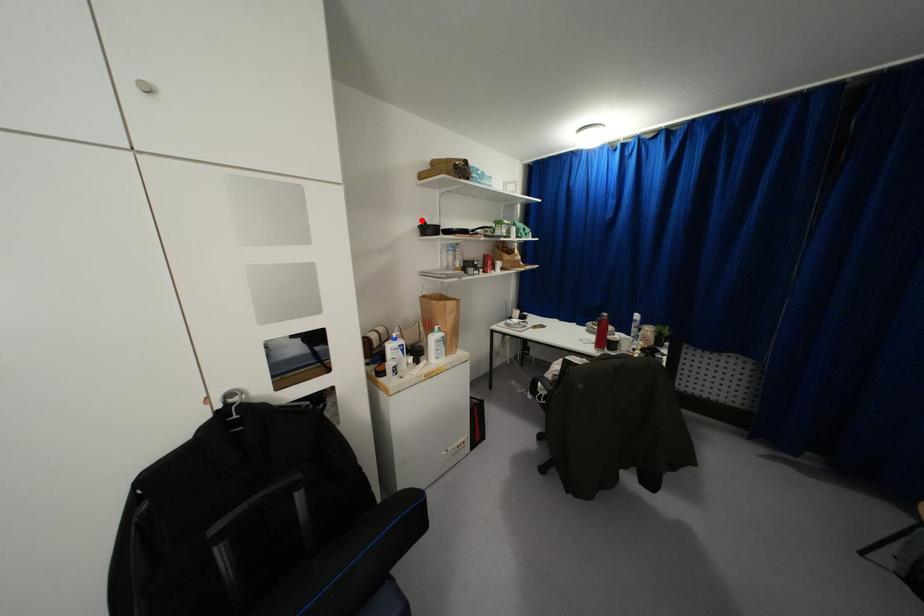
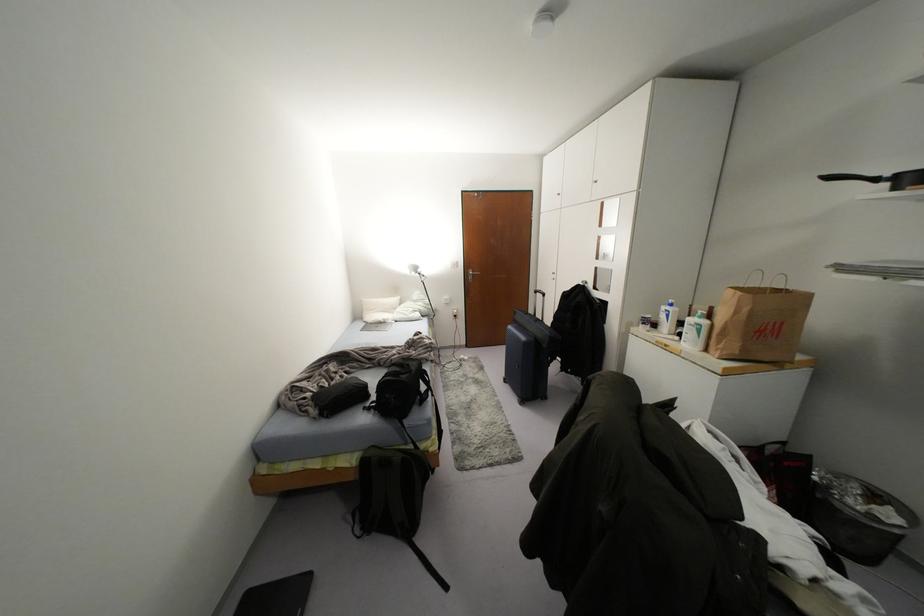
Question: I am providing you with two images of the same scene from different viewpoints. Given a red point in image1, look at the same physical point in image2. Is it:

Choices:
 (A) Closer to the viewpoint
 (B) Farther from the viewpoint

Answer: (B)